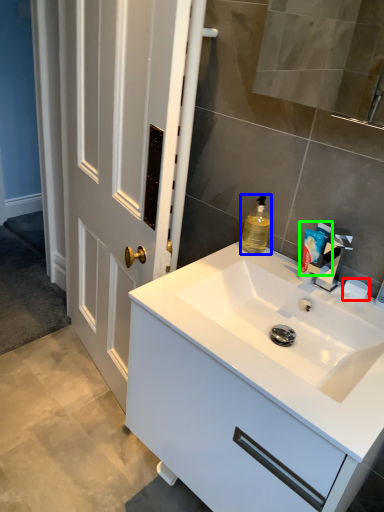
Question: Which object is positioned farthest from soap (highlighted by a red box)? Select from cleaning product (highlighted by a blue box) and toiletry (highlighted by a green box).

Choices:
 (A) cleaning product
 (B) toiletry

Answer: (A)